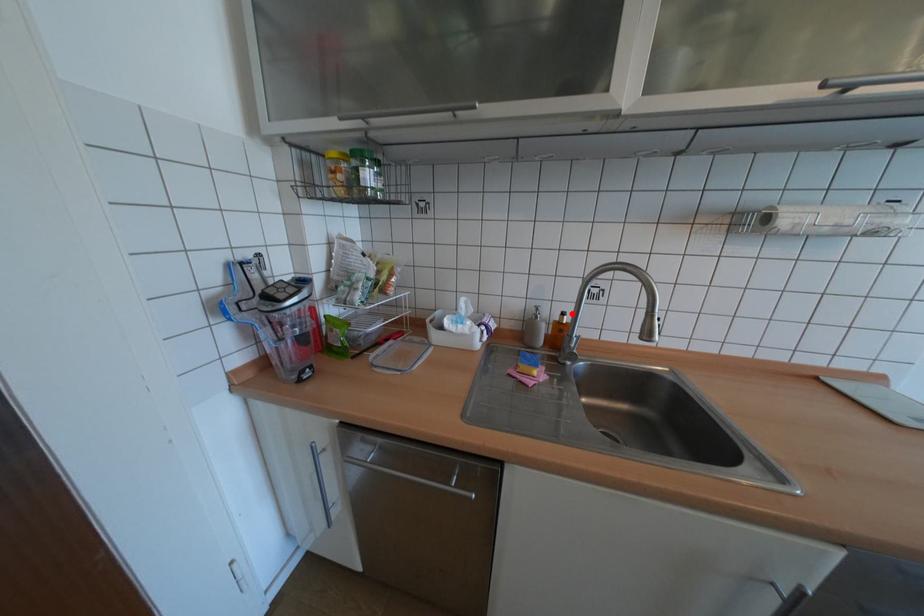
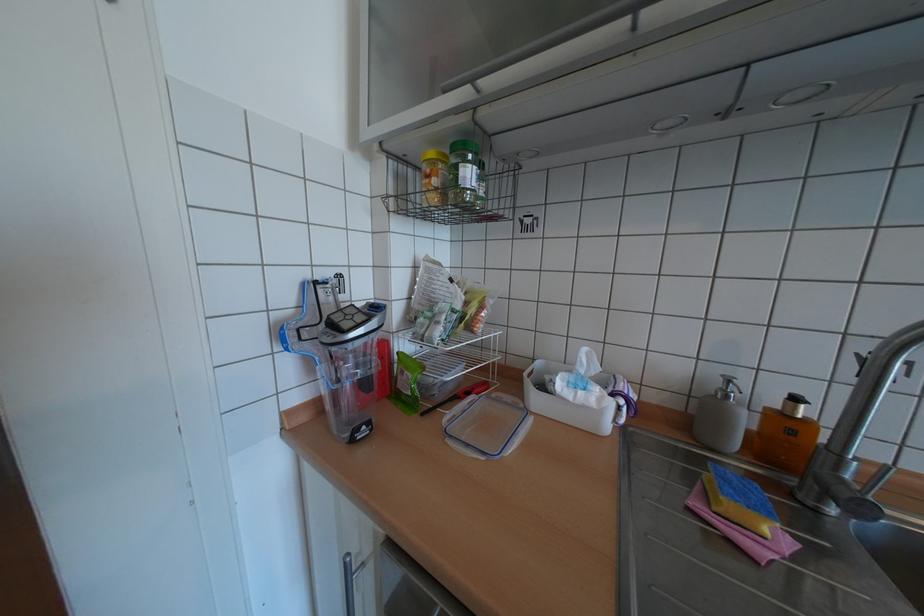
The point at the highlighted location is marked in the first image. Where is the corresponding point in the second image?

(805, 399)